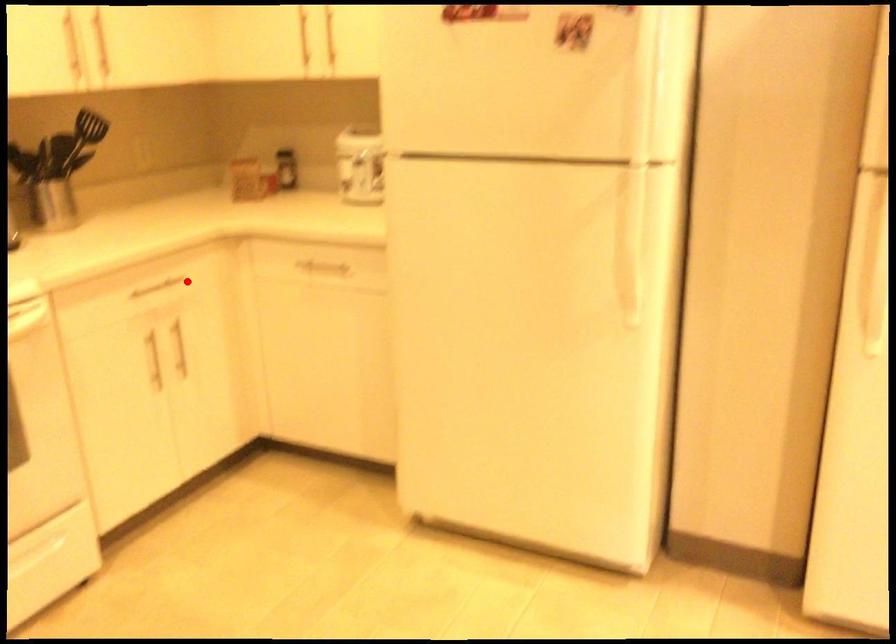
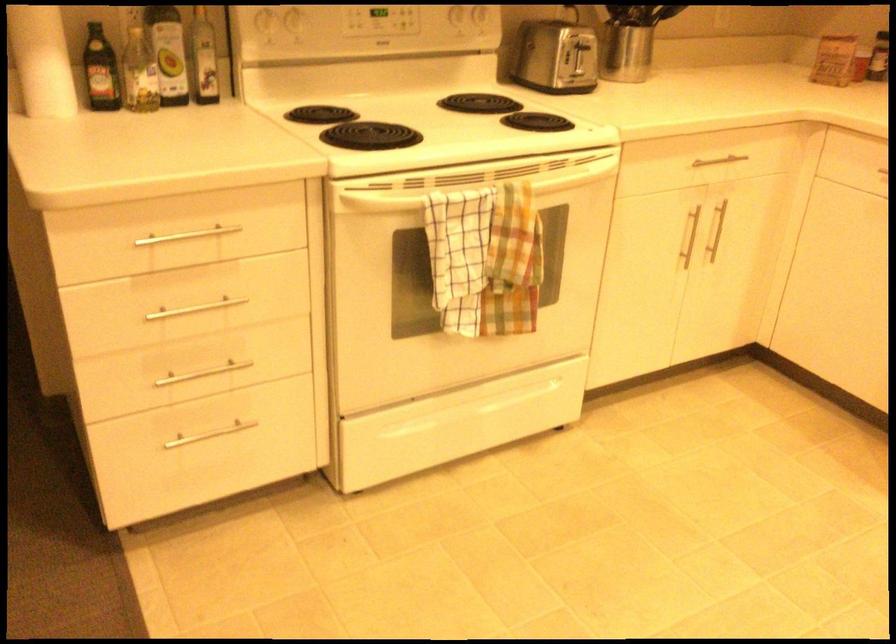
The point at the highlighted location is marked in the first image. Where is the corresponding point in the second image?

(745, 164)